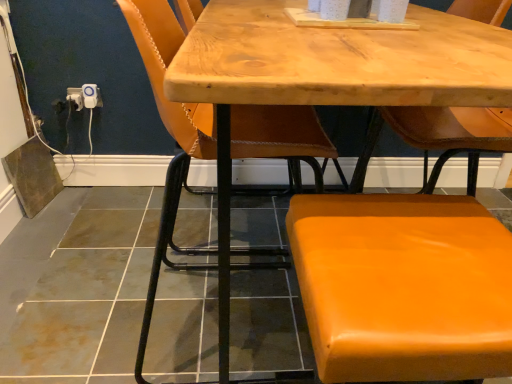
This screenshot has height=384, width=512. I want to click on free space above orange leather stool at lower right, which ranks as the 2th chair in left-to-right order (from a real-world perspective), so click(x=392, y=244).